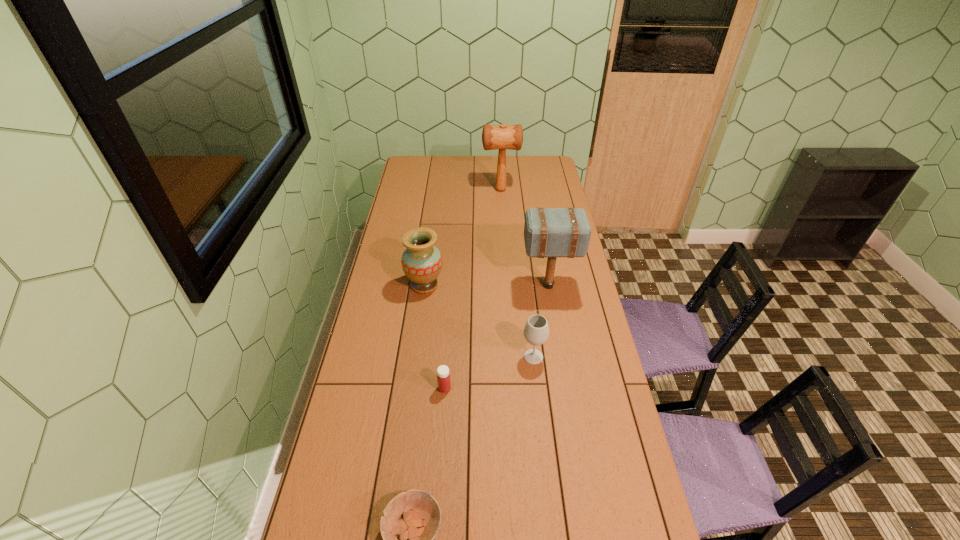
The width and height of the screenshot is (960, 540). Identify the location of vacant space located on the striking surface of the nearer mallet. (457, 286).

Where is `free spot located on the striking surface of the nearer mallet`? The image size is (960, 540). free spot located on the striking surface of the nearer mallet is located at coordinates (431, 286).

This screenshot has height=540, width=960. Find the location of `vacant space located 0.180m on the striking surface of the nearer mallet`. vacant space located 0.180m on the striking surface of the nearer mallet is located at coordinates (479, 286).

Identify the location of free space located on the right of the third tallest object. (496, 285).

Identify the location of vacant region located on the back of the third nearest object. (529, 315).

Where is `vacant space positioned 0.140m on the back of the second nearest object`? This screenshot has width=960, height=540. vacant space positioned 0.140m on the back of the second nearest object is located at coordinates (447, 350).

Where is `object positioned at the left edge`? object positioned at the left edge is located at coordinates (421, 262).

Locate an element on the screen. The width and height of the screenshot is (960, 540). object present at the right edge is located at coordinates (548, 232).

You are a GUI agent. You are given a task and a screenshot of the screen. Output one action in this format:
    pyautogui.click(x=<x>, y=<y>)
    Task: Click on the free region at the far edge of the desktop
    The width and height of the screenshot is (960, 540).
    Given the screenshot: What is the action you would take?
    pyautogui.click(x=525, y=174)

Locate an element on the screen. vacant space at the left edge is located at coordinates (391, 242).